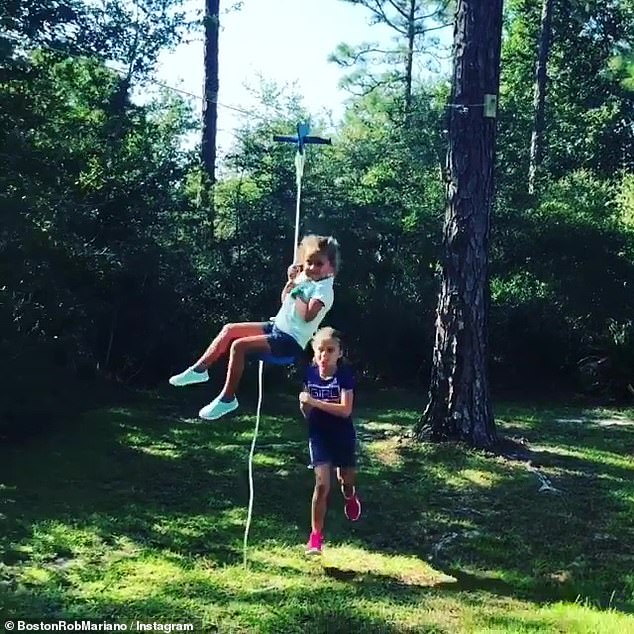
Locate an element on the screen. This screenshot has width=634, height=634. seat is located at coordinates (281, 359).